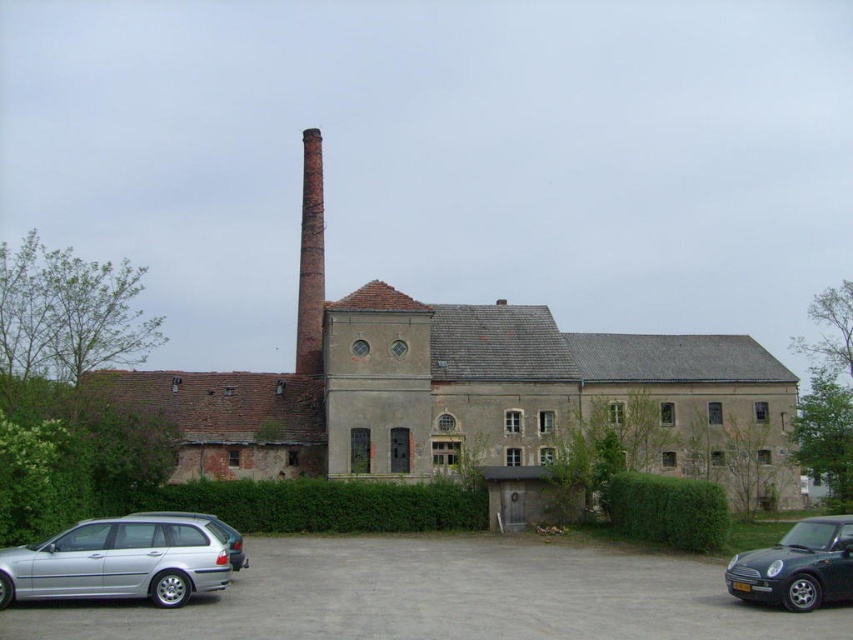
You are a photographer trying to capture the old industrial building in the background. You have a silver metallic car at lower left and a green leafy hedge at center in your current frame. Which object should you move closer to ensure the building is fully visible in the photo?

The silver metallic car at lower left has a lesser width compared to green leafy hedge at center, so moving closer to the silver metallic car at lower left would allow more space in the frame for the building to be fully visible.

You are standing at the entrance of the old industrial building and want to park your car near the green leafy hedge at center. Where should you position your silver metallic car at lower left relative to the hedge?

You should position the silver metallic car at lower left to the left of the green leafy hedge at center, as it is already located there according to the description.

You are standing in front of an old industrial building with a tall chimney. You notice a green leafy hedge somewhere in the scene. Based on the coordinates provided, where exactly is the green leafy hedge at center located?

The green leafy hedge at center is located at point (326, 504).